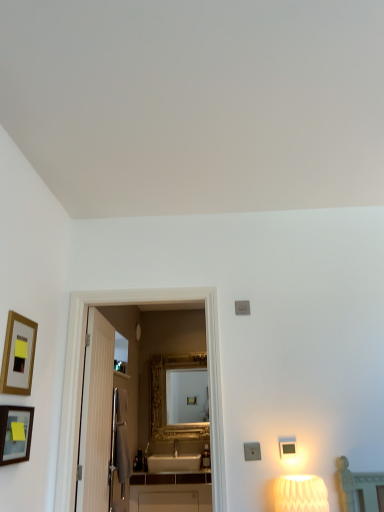
Question: Is gold-framed picture at left, which ranks as the second picture frame in bottom-to-top order, located outside matte gold picture frame at left, which ranks as the 1th picture frame in bottom-to-top order?

Choices:
 (A) no
 (B) yes

Answer: (B)

Question: Does gold-framed picture at left, positioned as the 1th picture frame in top-to-bottom order, contain matte gold picture frame at left, which ranks as the 1th picture frame in bottom-to-top order?

Choices:
 (A) yes
 (B) no

Answer: (B)

Question: Can you confirm if gold-framed picture at left, which ranks as the second picture frame in bottom-to-top order, is smaller than matte gold picture frame at left, which ranks as the 1th picture frame in bottom-to-top order?

Choices:
 (A) yes
 (B) no

Answer: (A)

Question: Does gold-framed picture at left, which ranks as the second picture frame in bottom-to-top order, come in front of matte gold picture frame at left, placed as the 2th picture frame when sorted from top to bottom?

Choices:
 (A) yes
 (B) no

Answer: (B)

Question: Is gold-framed picture at left, positioned as the 1th picture frame in top-to-bottom order, wider than matte gold picture frame at left, which ranks as the 1th picture frame in bottom-to-top order?

Choices:
 (A) no
 (B) yes

Answer: (A)

Question: From the image's perspective, is matte gold picture frame at left, placed as the 2th picture frame when sorted from top to bottom, located above or below gold-framed picture at left, which ranks as the second picture frame in bottom-to-top order?

Choices:
 (A) above
 (B) below

Answer: (B)

Question: Is matte gold picture frame at left, placed as the 2th picture frame when sorted from top to bottom, taller or shorter than gold-framed picture at left, which ranks as the second picture frame in bottom-to-top order?

Choices:
 (A) short
 (B) tall

Answer: (A)

Question: Is matte gold picture frame at left, placed as the 2th picture frame when sorted from top to bottom, in front of or behind gold-framed picture at left, positioned as the 1th picture frame in top-to-bottom order, in the image?

Choices:
 (A) front
 (B) behind

Answer: (A)

Question: Does point (0, 409) appear closer or farther from the camera than point (11, 335)?

Choices:
 (A) farther
 (B) closer

Answer: (B)

Question: From a real-world perspective, is gold ornate mirror at center positioned above or below matte gold picture frame at left, placed as the 2th picture frame when sorted from top to bottom?

Choices:
 (A) above
 (B) below

Answer: (A)

Question: In terms of width, does gold ornate mirror at center look wider or thinner when compared to matte gold picture frame at left, placed as the 2th picture frame when sorted from top to bottom?

Choices:
 (A) thin
 (B) wide

Answer: (B)

Question: Based on their sizes in the image, would you say gold ornate mirror at center is bigger or smaller than matte gold picture frame at left, placed as the 2th picture frame when sorted from top to bottom?

Choices:
 (A) small
 (B) big

Answer: (B)

Question: Is gold ornate mirror at center spatially inside matte gold picture frame at left, placed as the 2th picture frame when sorted from top to bottom, or outside of it?

Choices:
 (A) outside
 (B) inside

Answer: (A)

Question: In the image, is white textured lampshade at lower right positioned in front of or behind gold-framed picture at left, positioned as the 1th picture frame in top-to-bottom order?

Choices:
 (A) front
 (B) behind

Answer: (B)

Question: Do you think white textured lampshade at lower right is within gold-framed picture at left, which ranks as the second picture frame in bottom-to-top order, or outside of it?

Choices:
 (A) outside
 (B) inside

Answer: (A)